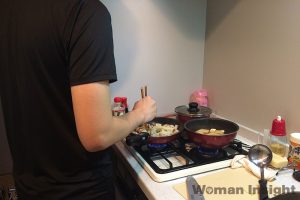
Locate an element on the screen. The image size is (300, 200). walls is located at coordinates (240, 53), (167, 49).